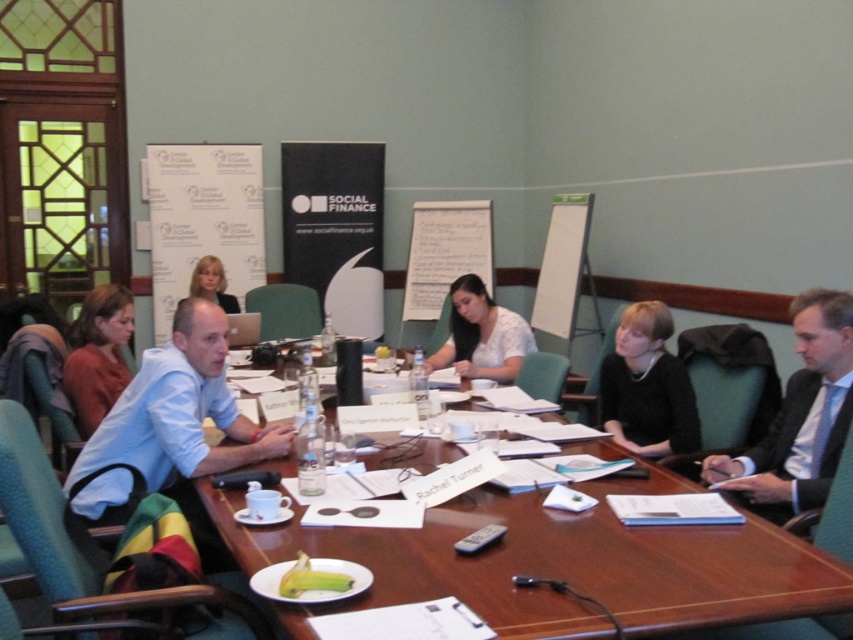
Does white paper at center have a larger size compared to matte brown hair at upper left?

Correct, white paper at center is larger in size than matte brown hair at upper left.

Locate an element on the screen. The width and height of the screenshot is (853, 640). white paper at center is located at coordinates (445, 252).

Is light blue suit at right thinner than white matte blouse at center?

Yes.

Is light blue suit at right positioned before white matte blouse at center?

Yes.

This screenshot has width=853, height=640. I want to click on light blue suit at right, so click(x=799, y=416).

Consider the image. Is wooden table at center below black matte dress at center?

Indeed, wooden table at center is positioned under black matte dress at center.

Locate an element on the screen. Image resolution: width=853 pixels, height=640 pixels. wooden table at center is located at coordinates (561, 564).

Identify the location of wooden table at center. (561, 564).